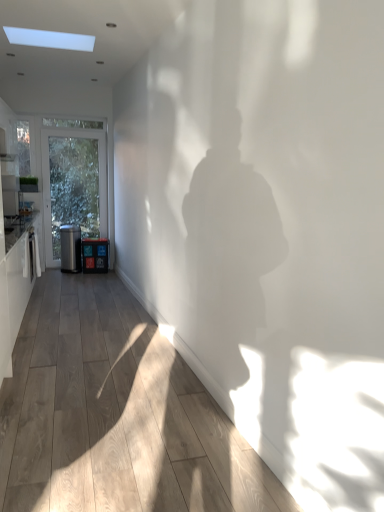
Question: Considering the positions of wooden floor at center and white glossy cabinetry at left in the image, is wooden floor at center taller or shorter than white glossy cabinetry at left?

Choices:
 (A) tall
 (B) short

Answer: (B)

Question: From a real-world perspective, is wooden floor at center positioned above or below white glossy cabinetry at left?

Choices:
 (A) above
 (B) below

Answer: (B)

Question: Considering the real-world distances, which object is farthest from the matte black trash can at left, positioned as the 2th appliance in left-to-right order?

Choices:
 (A) white glossy cabinetry at left
 (B) satin black trash can at left, which is the second appliance in right-to-left order
 (C) wooden floor at center

Answer: (C)

Question: Based on their relative distances, which object is farther from the satin black trash can at left, which is the second appliance in right-to-left order?

Choices:
 (A) wooden floor at center
 (B) white glossy cabinetry at left
 (C) matte black trash can at left, positioned as the 2th appliance in left-to-right order

Answer: (A)